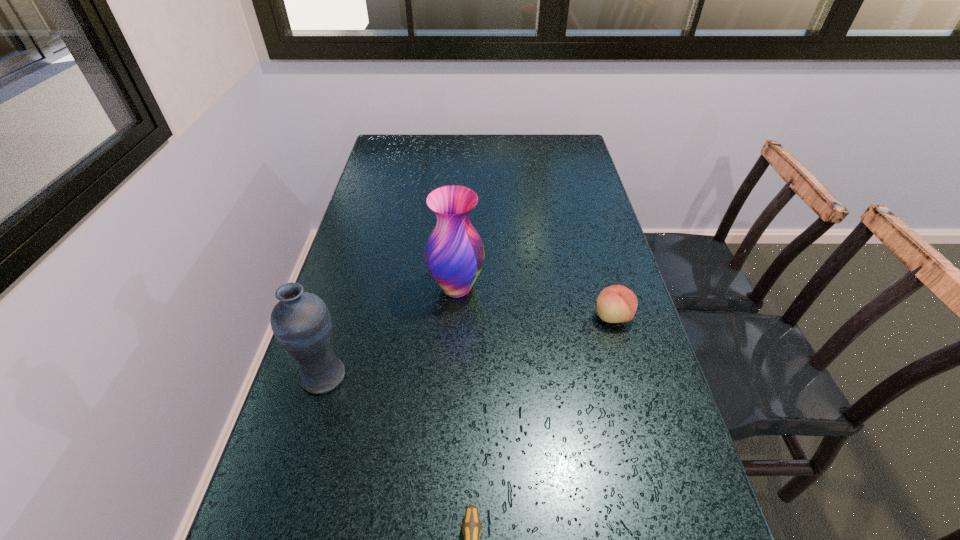
The image size is (960, 540). Find the location of `vacant area that lies between the peach and the farther vase`. vacant area that lies between the peach and the farther vase is located at coordinates click(535, 302).

Locate which object is the second closest to the nearest object. Please provide its 2D coordinates. Your answer should be formatted as a tuple, i.e. [(x, y)], where the tuple contains the x and y coordinates of a point satisfying the conditions above.

[(454, 253)]

Point out which object is positioned as the nearest to the nearest object. Please provide its 2D coordinates. Your answer should be formatted as a tuple, i.e. [(x, y)], where the tuple contains the x and y coordinates of a point satisfying the conditions above.

[(301, 322)]

Locate an element on the screen. The height and width of the screenshot is (540, 960). vacant area in the image that satisfies the following two spatial constraints: 1. on the back side of the rightmost object; 2. on the right side of the left vase is located at coordinates (342, 316).

Where is `vacant space that satisfies the following two spatial constraints: 1. on the front side of the peach; 2. on the left side of the farther vase`? Image resolution: width=960 pixels, height=540 pixels. vacant space that satisfies the following two spatial constraints: 1. on the front side of the peach; 2. on the left side of the farther vase is located at coordinates (455, 316).